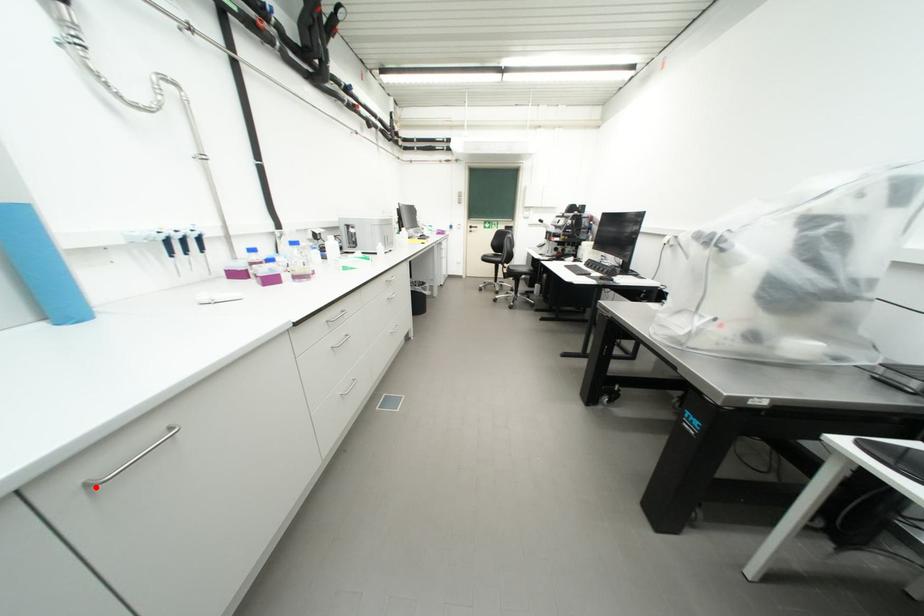
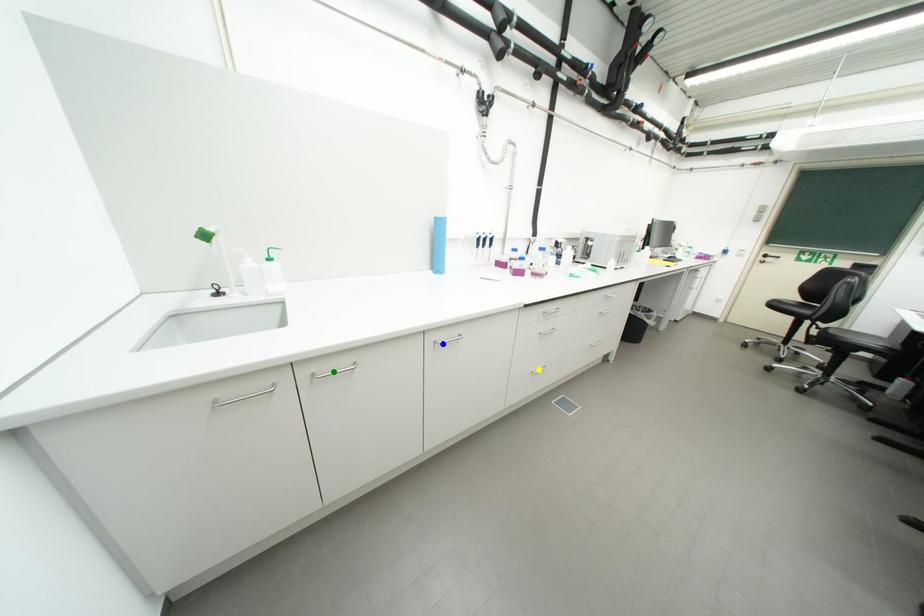
Question: I am providing you with two images of the same scene from different viewpoints. A red point is marked on the first image. You are given multiple points on the second image. Which spot in image 2 lines up with the point in image 1?

Choices:
 (A) blue point
 (B) yellow point
 (C) green point

Answer: (A)